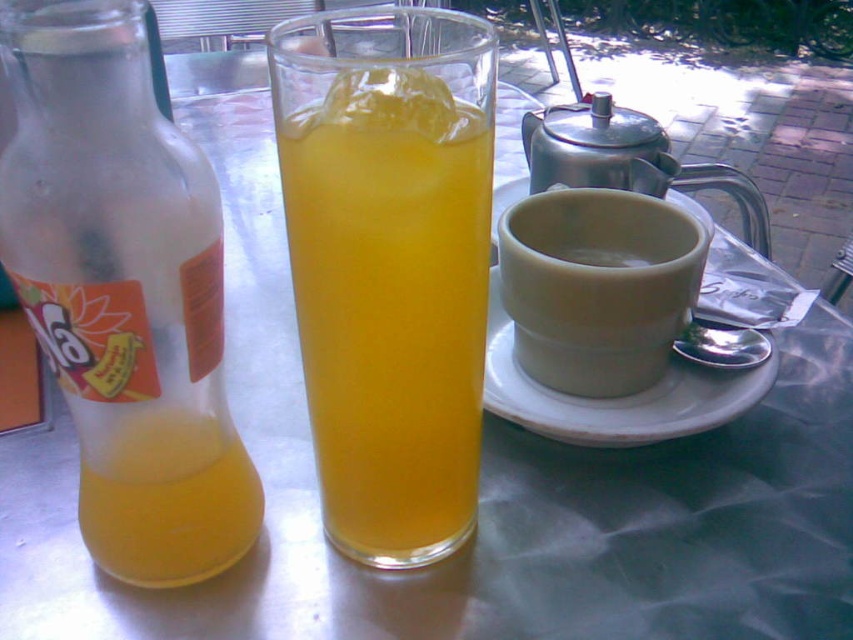
Consider the image. Which is above, translucent glass bottle at left or matte ceramic mug at right?

matte ceramic mug at right

Find the location of a particular element. translucent glass bottle at left is located at coordinates (125, 291).

Can you confirm if translucent glass at center is positioned to the right of matte ceramic mug at right?

In fact, translucent glass at center is to the left of matte ceramic mug at right.

Is point (463, 65) farther from viewer compared to point (576, 289)?

That is False.

Where is `translucent glass at center`? This screenshot has width=853, height=640. translucent glass at center is located at coordinates (389, 264).

Between matte ceramic mug at right and white ceramic saucer at right, which one is positioned lower?

white ceramic saucer at right is lower down.

Does matte ceramic mug at right come behind white ceramic saucer at right?

No, it is not.

Identify the location of matte ceramic mug at right. This screenshot has height=640, width=853. (596, 285).

The width and height of the screenshot is (853, 640). What are the coordinates of `matte ceramic mug at right` in the screenshot? It's located at (596, 285).